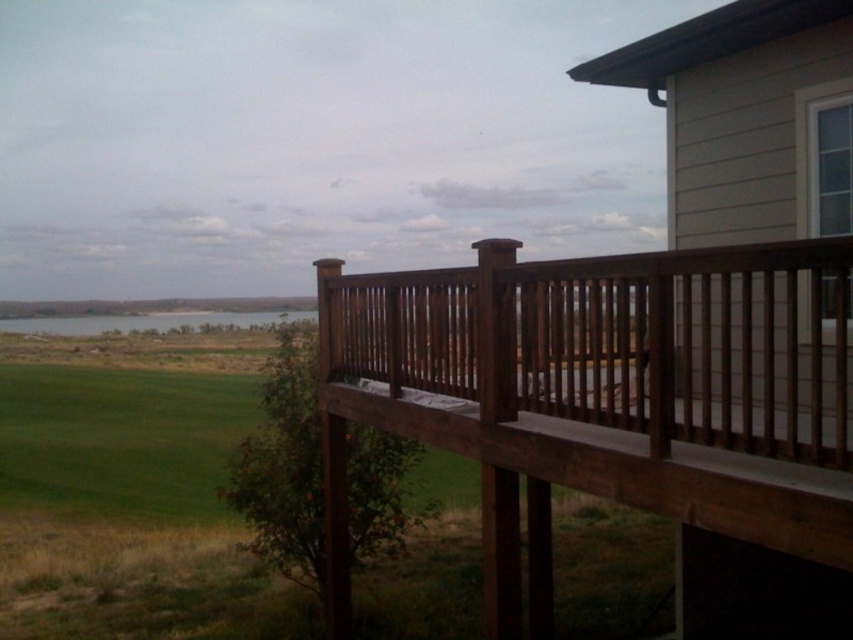
You are standing on the wooden deck and want to move towards the brown wood porch at right. Which direction should you walk from the green grassy field at lower left?

You should walk to the right from the green grassy field at lower left to reach the brown wood porch at right because the brown wood porch at right is located to the right of the green grassy field at lower left.

You are standing on the deck and want to move from the brown wood porch at right to the green grassy field at lower left. What should you be cautious about due to their height difference?

The brown wood porch at right is much taller than the green grassy field at lower left, so you should be cautious of the significant drop when moving from the brown wood porch at right to the green grassy field at lower left.